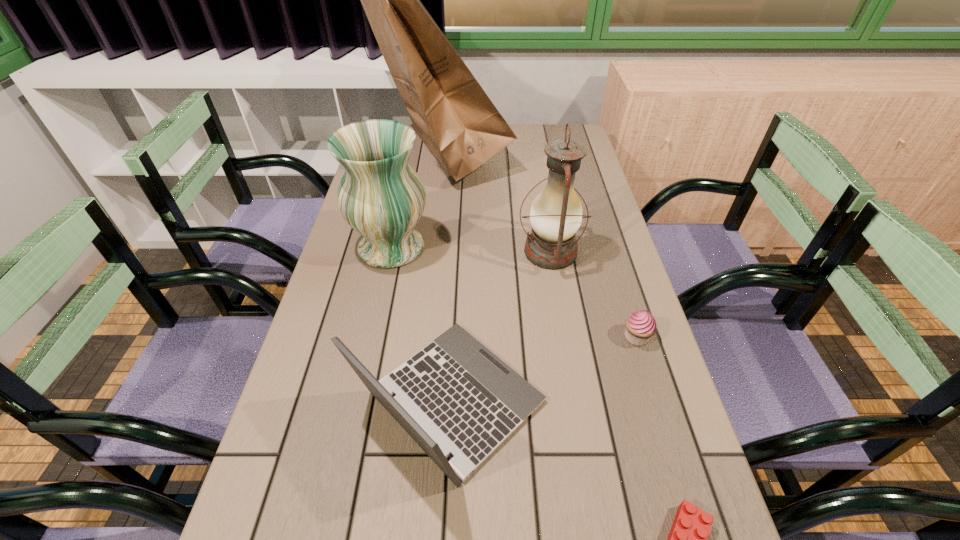
Image resolution: width=960 pixels, height=540 pixels. Identify the location of grocery bag. (451, 113).

Find the location of a particular element. This screenshot has height=540, width=960. the tallest object is located at coordinates (451, 113).

Locate an element on the screen. The width and height of the screenshot is (960, 540). oil lamp is located at coordinates (556, 213).

In order to click on vase in this screenshot , I will do `click(380, 195)`.

The height and width of the screenshot is (540, 960). I want to click on the fourth tallest object, so 455,396.

I want to click on cupcake, so click(x=640, y=326).

Locate an element on the screen. This screenshot has width=960, height=540. vacant space situated 0.200m on the front of the tallest object is located at coordinates (435, 232).

You are a GUI agent. You are given a task and a screenshot of the screen. Output one action in this format:
    pyautogui.click(x=<x>, y=<y>)
    Task: Click on the vacant space located on the left of the oil lamp
    Image resolution: width=960 pixels, height=540 pixels.
    Given the screenshot: What is the action you would take?
    pyautogui.click(x=467, y=252)

At what (x,y) coordinates should I click in order to perform the action: click on vacant area situated 0.150m on the back of the vase. Please return your answer as a coordinate pair (x, y). Looking at the image, I should click on (403, 194).

Find the location of `vacant space located at the front screen of the fourth tallest object`. vacant space located at the front screen of the fourth tallest object is located at coordinates (585, 402).